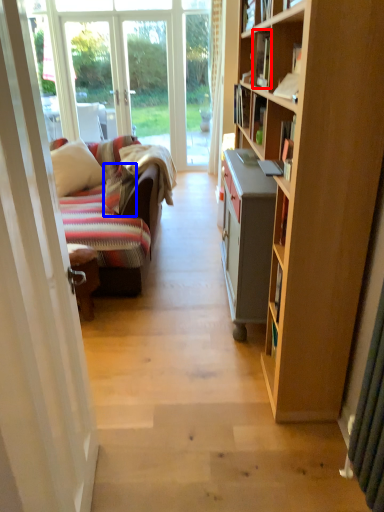
Question: Which point is further to the camera, book (highlighted by a red box) or pillow (highlighted by a blue box)?

Choices:
 (A) book
 (B) pillow

Answer: (B)